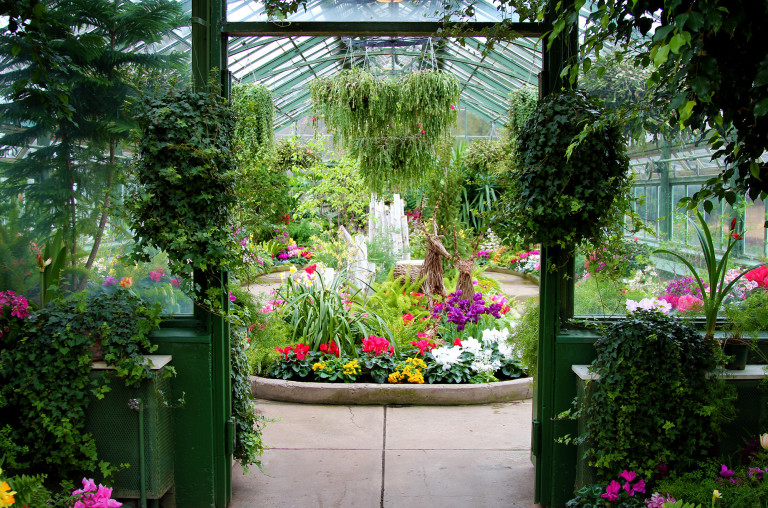
Where is `doorway`? This screenshot has height=508, width=768. doorway is located at coordinates (216, 457).